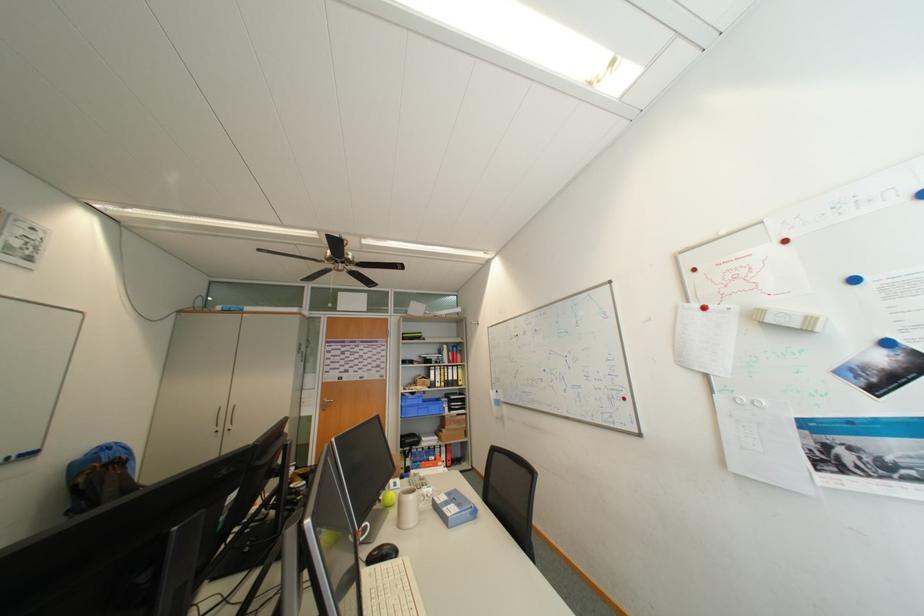
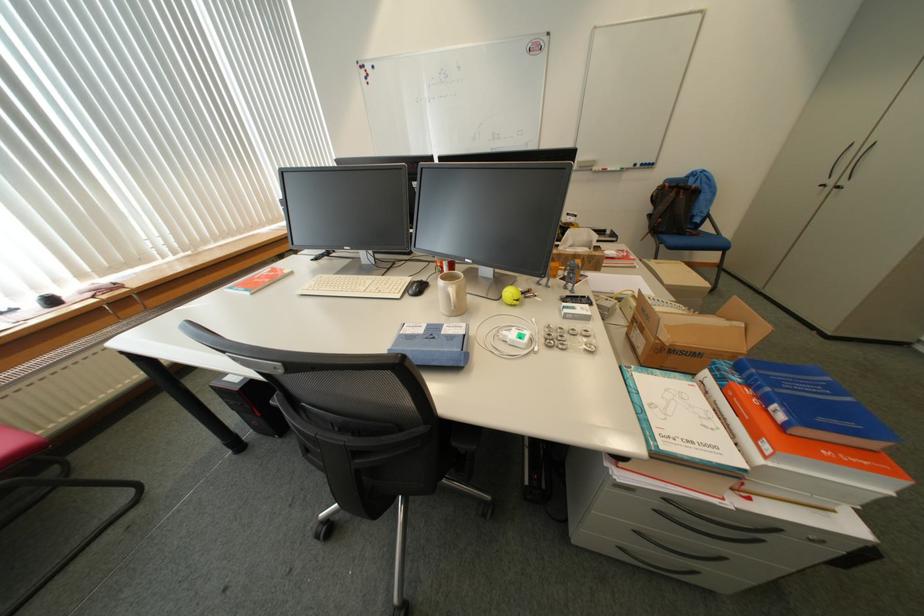
The point at [443,459] is marked in the first image. Where is the corresponding point in the second image?

(791, 418)